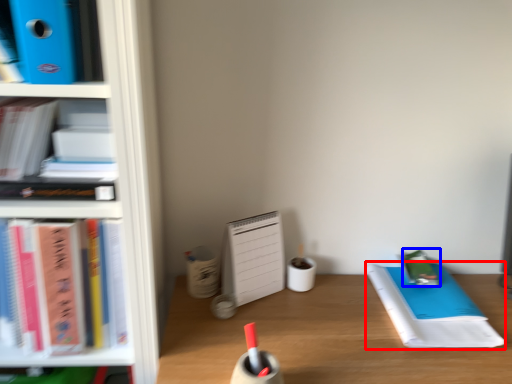
Question: Which object is closer to the camera taking this photo, notebook (highlighted by a red box) or stationery (highlighted by a blue box)?

Choices:
 (A) notebook
 (B) stationery

Answer: (A)